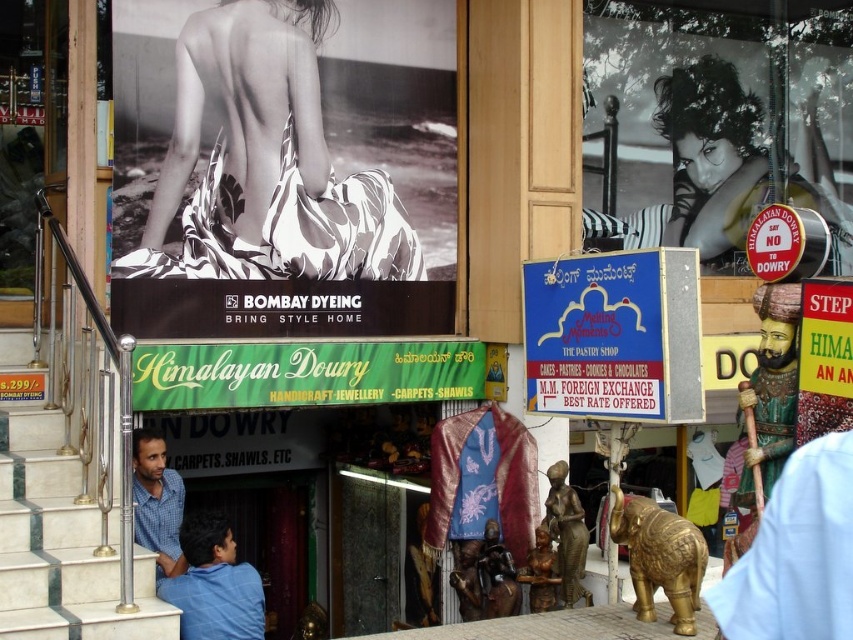
Question: Which point is farther to the camera?

Choices:
 (A) (192, 598)
 (B) (28, 51)

Answer: (B)

Question: Is black glossy poster at upper right in front of white marble stairs at lower left?

Choices:
 (A) yes
 (B) no

Answer: (B)

Question: Estimate the real-world distances between objects in this image. Which object is farther from the black glossy poster at upper right?

Choices:
 (A) green fabric signboard at center
 (B) brushed metal railing at left
 (C) white marble stairs at lower left

Answer: (C)

Question: Which of these objects is positioned farthest from the brushed metal railing at left?

Choices:
 (A) green fabric signboard at center
 (B) black glossy poster at upper right
 (C) blue shirt at lower left
 (D) blue checkered shirt at lower left

Answer: (B)

Question: Does white printed fabric at upper center appear on the left side of blue shirt at lower left?

Choices:
 (A) no
 (B) yes

Answer: (A)

Question: Can you confirm if white marble stairs at lower left is positioned to the left of brushed metal railing at left?

Choices:
 (A) yes
 (B) no

Answer: (B)